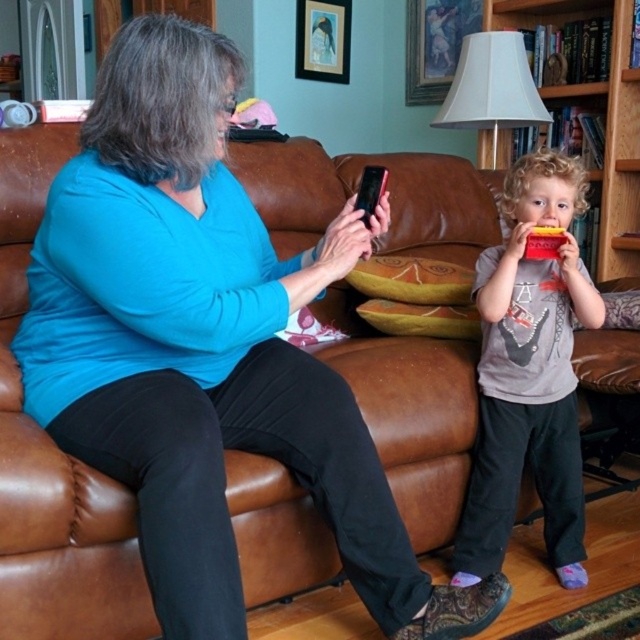
You are a delivery robot with a package that measures 1 meter in length. You need to navigate through the living room to place the package between the brown leather couch at center and the wooden bookshelf at right. Can you fit the package in the space between them?

The brown leather couch at center and wooden bookshelf at right are 90.97 centimeters apart from each other. Since the package is 1 meter long, which is 100 centimeters, the space between them is narrower than the package. Therefore, the package cannot fit in the space between them.

Based on the coordinates provided, can you identify the object located at point (x=52, y=460) in the living room scene?

The point at (x=52, y=460) corresponds to the brown leather couch at center.

You are standing in the living room and want to take a photo of both the point at coordinates (440,396) and the point at coordinates (545,396). Which point should you focus on first to ensure both are in focus?

You should focus on the point at coordinates (440,396) first because it is closer to the camera than the point at coordinates (545,396). This ensures both points will be in focus as the closer point sets the focal plane.